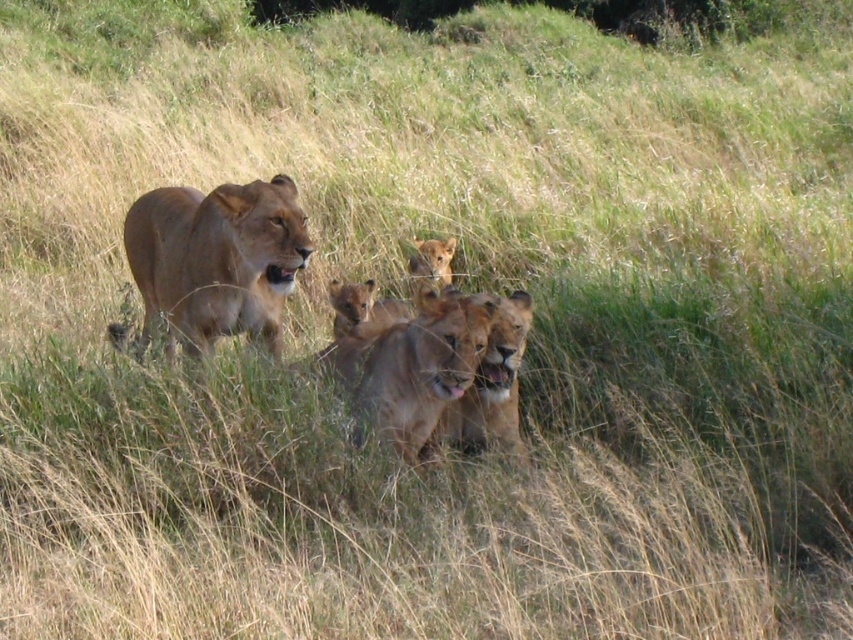
You are a wildlife photographer observing lions in the savanna. You notice a golden fur lioness at center and a golden fur cub at center. Which of these two has a greater height?

The golden fur lioness at center is much taller than the golden fur cub at center.

You are a wildlife photographer trying to capture a closeup shot of the golden fur cub at center. You notice the golden fur lioness at center is blocking your view. Based on their sizes, which animal should you focus on first to get a clear shot of the cub?

The golden fur lioness at center is larger than the golden fur cub at center, so you should focus on moving around or adjusting your angle to first ensure the larger lioness is positioned in a way that doesn